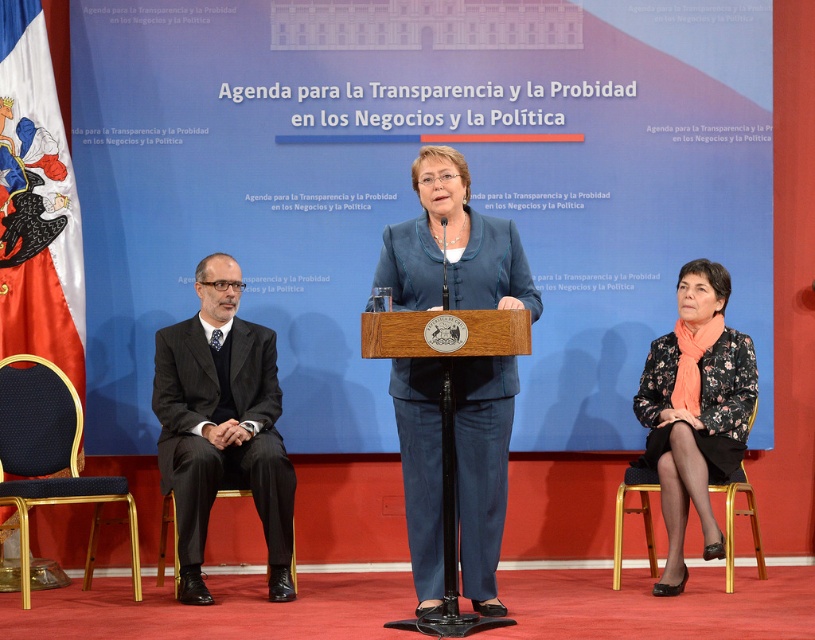
You are an event organizer who needs to arrange seating for attendees. You see the black suit at left and the metallic gold chair at lower right. Which object is placed on top of the other?

The black suit at left is positioned over metallic gold chair at lower right, so the black suit is placed on top of the metallic gold chair.

You are attending the event and need to sit down. There is a metallic gold chair at lower right. Is the black suit at left blocking your path to the chair?

The black suit at left is positioned on the left side of the metallic gold chair at lower right, so it is not blocking your path to the chair. You can approach the chair from the right side.